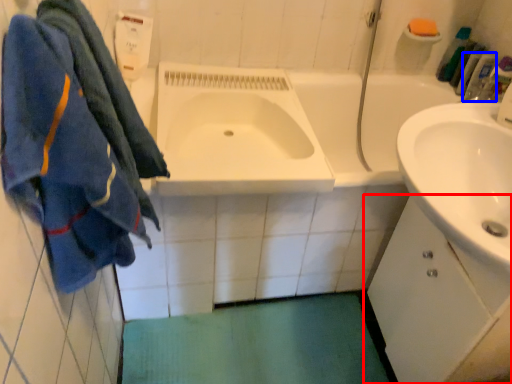
Question: Which object appears farthest to the camera in this image, bathroom cabinet (highlighted by a red box) or toiletry (highlighted by a blue box)?

Choices:
 (A) bathroom cabinet
 (B) toiletry

Answer: (B)